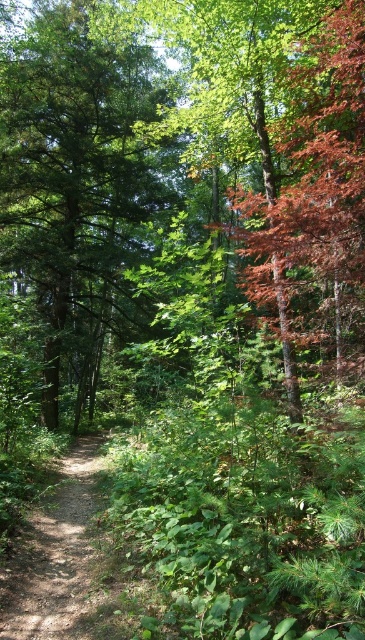
You are standing on the dirt path in the forest and see two points marked in the image. Which point is closer to you, point (55, 422) or point (94, 504)?

Point (94, 504) is closer to you because it is less further to the camera than point (55, 422).